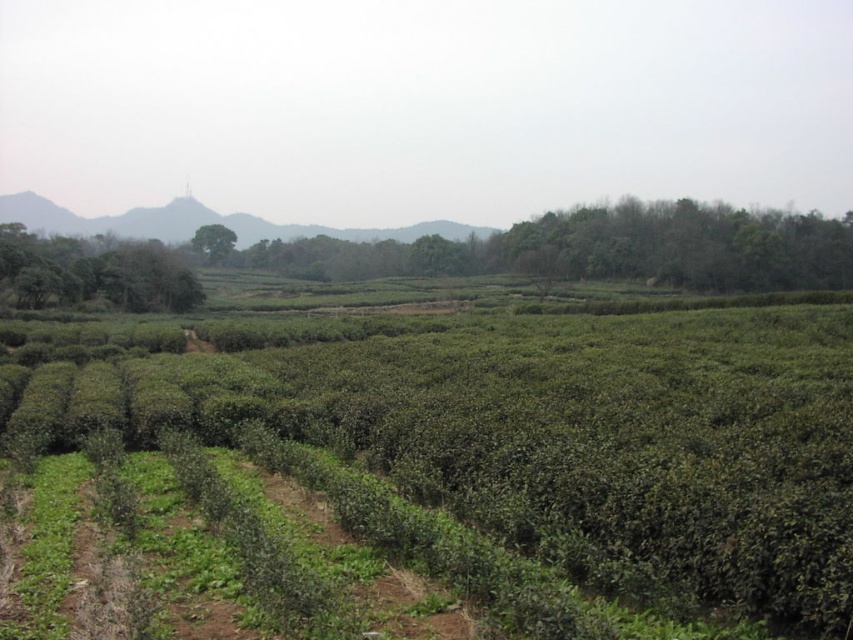
Can you confirm if green leafy tree at left is bigger than green leafy tree at center?

Yes.

Who is shorter, green leafy tree at left or green leafy tree at center?

green leafy tree at left is shorter.

Locate an element on the screen. The height and width of the screenshot is (640, 853). green leafy tree at left is located at coordinates (94, 273).